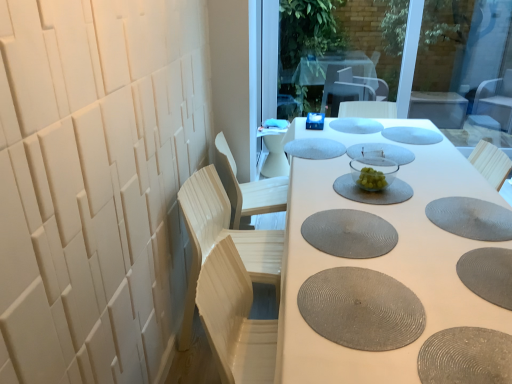
Locate an element on the screen. The width and height of the screenshot is (512, 384). vacant area that lies between gray textured placemat at lower right, the eighth manhole cover in the back-to-front sequence, and gray rubber mat at center, which appears as the 2th manhole cover when viewed from the back is located at coordinates (451, 190).